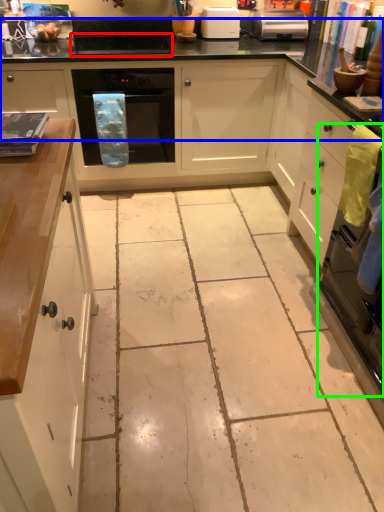
Question: Which object is the closest to the appliance (highlighted by a red box)? Choose among these: countertop (highlighted by a blue box) or oven (highlighted by a green box).

Choices:
 (A) countertop
 (B) oven

Answer: (A)